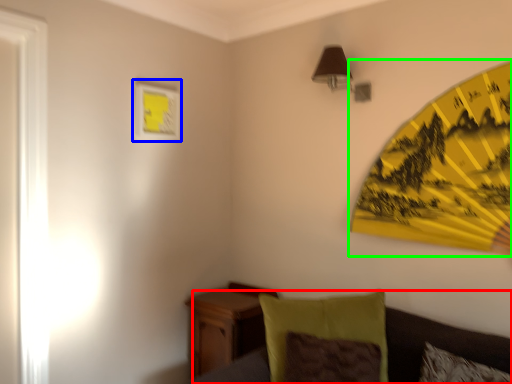
Question: Which is farther away from couch (highlighted by a red box)? picture frame (highlighted by a blue box) or umbrella (highlighted by a green box)?

Choices:
 (A) picture frame
 (B) umbrella

Answer: (B)